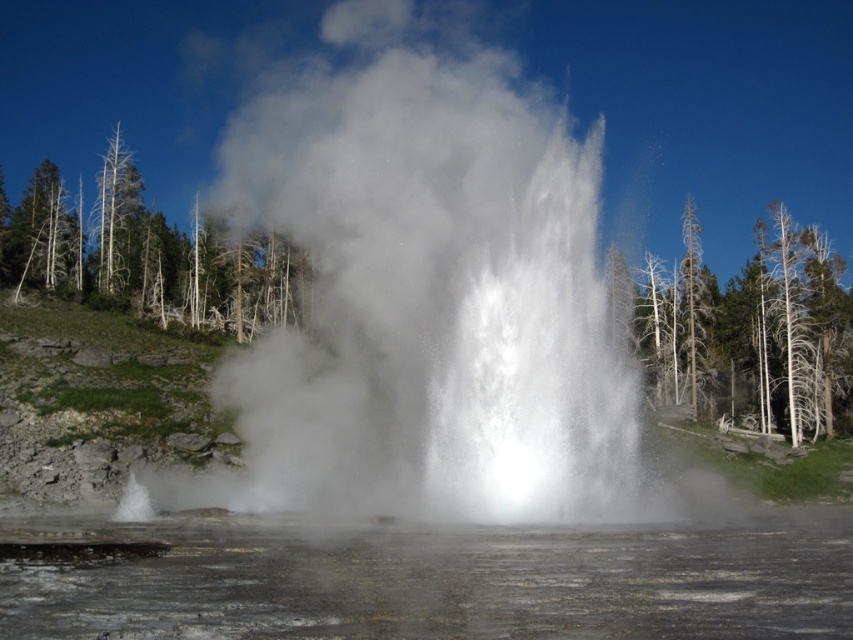
You are standing in front of the geyser scene. The translucent steam at center is part of the geyser. If you want to take a photo of the geyser without including the steam, how far back should you move from the current position?

The translucent steam at center is 5.81 meters away from viewer. To avoid capturing the steam in your photo, you should move back to a distance greater than 5.81 meters from the geyser.

You are a photographer trying to capture the geyser and the dead wood trees in the background. If you want to include both the dead wood trees at right and the dead wood tree at left in your photo, which tree will appear taller in the frame?

The dead wood tree at left will appear taller in the frame because it has a greater height compared to the dead wood trees at right.

You are a photographer trying to capture the geyser eruption. You want to frame the translucent steam at center so that it appears above the green leafy trees at left in your photo. Is this possible given their current positions?

The translucent steam at center is positioned under the green leafy trees at left, so it cannot appear above them in the photo as they are currently positioned.